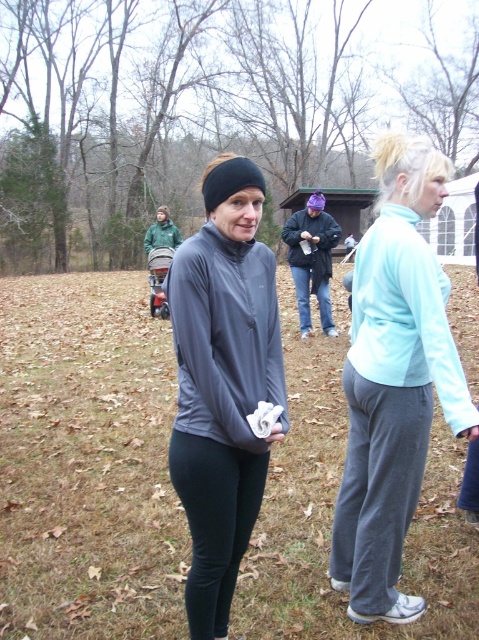
Question: Which of the following is the farthest from the observer?

Choices:
 (A) light blue fleece at right
 (B) dark gray fleece sweatshirt at center
 (C) gray sweatpants at lower right
 (D) matte gray jacket at center

Answer: (B)

Question: Among these points, which one is farthest from the camera?

Choices:
 (A) (235, 428)
 (B) (375, 305)

Answer: (B)

Question: Can you confirm if matte gray sweatshirt at center is wider than black matte leggings at center?

Choices:
 (A) no
 (B) yes

Answer: (B)

Question: Where is light blue fleece at right located in relation to dark gray fleece sweatshirt at center in the image?

Choices:
 (A) below
 (B) above

Answer: (A)

Question: Which object is closer to the camera taking this photo?

Choices:
 (A) matte gray sweatshirt at center
 (B) black matte leggings at center

Answer: (A)

Question: Does light blue fleece at right appear over black matte leggings at center?

Choices:
 (A) no
 (B) yes

Answer: (B)